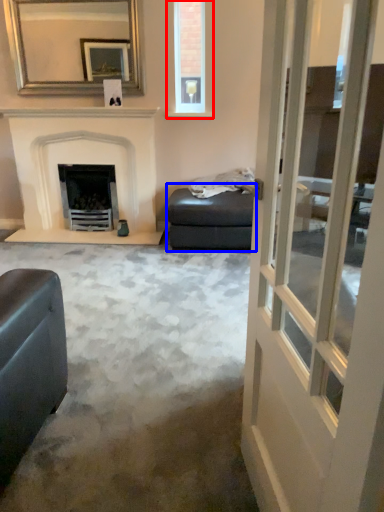
Question: Which object is further to the camera taking this photo, window (highlighted by a red box) or footrest (highlighted by a blue box)?

Choices:
 (A) window
 (B) footrest

Answer: (A)